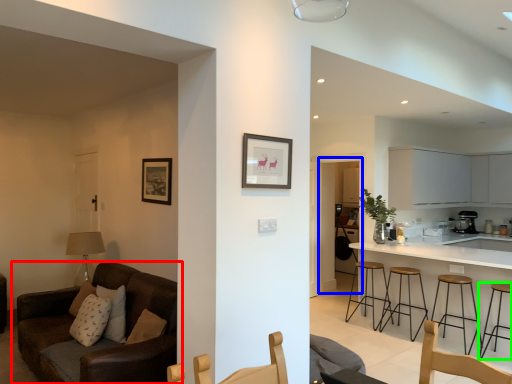
Question: Estimate the real-world distances between objects in this image. Which object is farther from studio couch (highlighted by a red box), glass door (highlighted by a blue box) or stool (highlighted by a green box)?

Choices:
 (A) glass door
 (B) stool

Answer: (A)